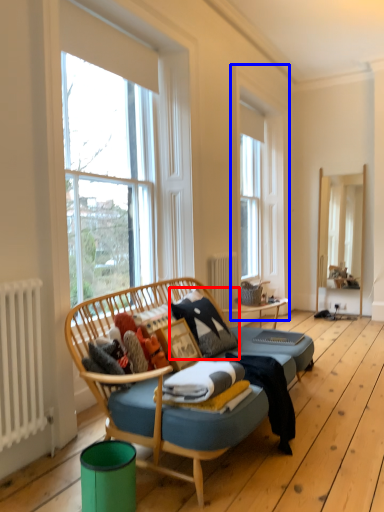
Question: Which of the following is the closest to the observer, pillow (highlighted by a red box) or window frame (highlighted by a blue box)?

Choices:
 (A) pillow
 (B) window frame

Answer: (A)